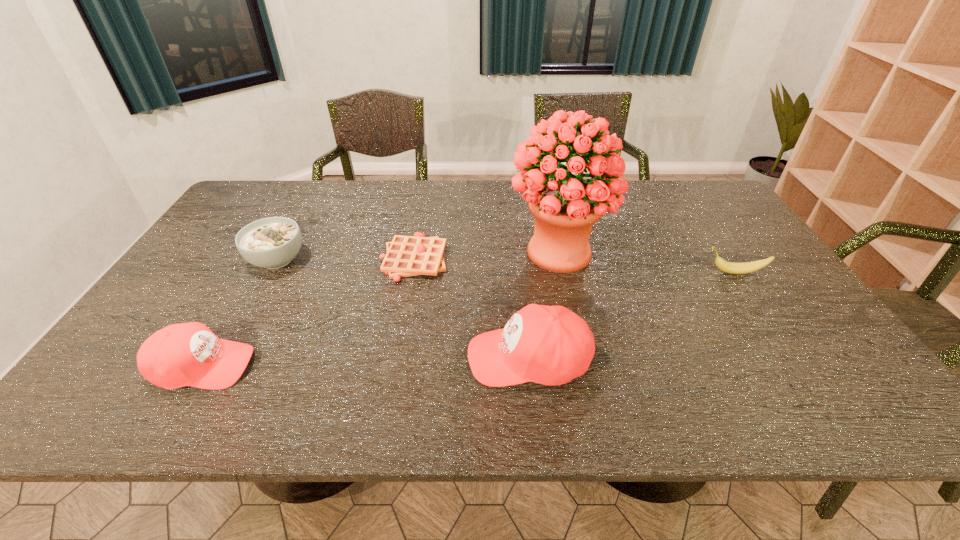
The width and height of the screenshot is (960, 540). Find the location of `blank region between the taller baseball cap and the soup bowl`. blank region between the taller baseball cap and the soup bowl is located at coordinates (402, 309).

Locate an element on the screen. vacant area that lies between the tallest object and the right baseball cap is located at coordinates (543, 305).

I want to click on free space between the left baseball cap and the fifth shortest object, so click(x=366, y=362).

Where is `free space between the taller baseball cap and the banana`? This screenshot has width=960, height=540. free space between the taller baseball cap and the banana is located at coordinates (632, 315).

The width and height of the screenshot is (960, 540). I want to click on free space that is in between the third object from left to right and the bouquet, so click(486, 255).

I want to click on vacant space in between the right baseball cap and the waffle, so pyautogui.click(x=471, y=308).

Find the location of a particular element. This screenshot has width=960, height=540. the closest object to the second shortest object is located at coordinates (565, 209).

The height and width of the screenshot is (540, 960). Identify the location of the fourth closest object to the second tallest object. (188, 354).